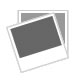
The height and width of the screenshot is (80, 80). What are the coordinates of `two polaroid pictures` in the screenshot? It's located at (53, 36), (63, 23).